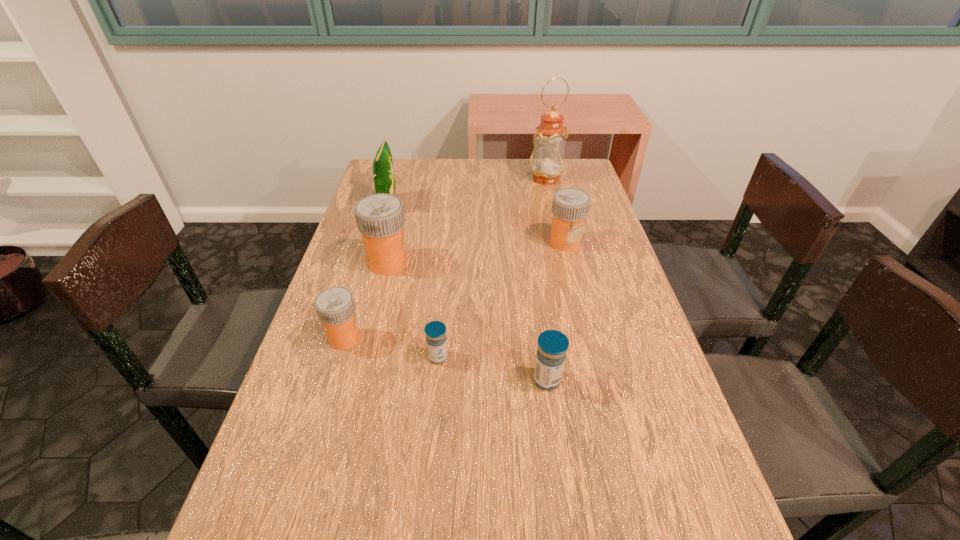
This screenshot has width=960, height=540. What are the coordinates of `oil lamp` in the screenshot? It's located at (546, 162).

Identify the location of the farthest object. This screenshot has width=960, height=540. (546, 162).

The image size is (960, 540). In order to click on crisp (potato chip) in this screenshot , I will do `click(384, 181)`.

Where is `green crisp (potato chip)`? green crisp (potato chip) is located at coordinates (384, 181).

What are the coordinates of `the tallest medicine` in the screenshot? It's located at (380, 219).

The image size is (960, 540). I want to click on the fourth tallest object, so click(x=570, y=206).

Locate an element on the screen. the rightmost medicine is located at coordinates [x=570, y=206].

Find the location of a particular element. This screenshot has width=960, height=540. the smallest orange medicine is located at coordinates (335, 306).

Where is `the third object from right to left`? This screenshot has height=540, width=960. the third object from right to left is located at coordinates (552, 345).

At what (x,y) coordinates should I click in order to perform the action: click on the fourth medicine from left to right. Please return your answer as a coordinate pair (x, y). Looking at the image, I should click on (552, 345).